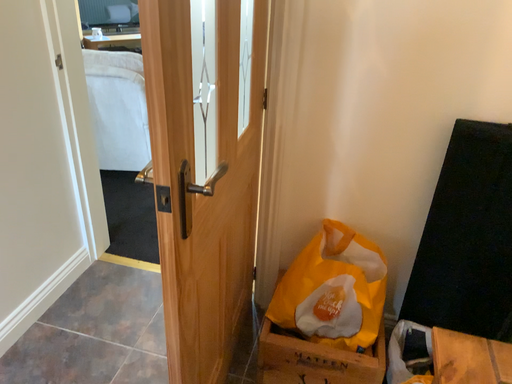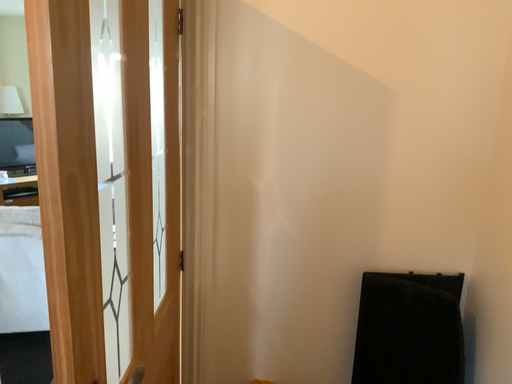
Question: Which way did the camera rotate in the video?

Choices:
 (A) rotated left
 (B) rotated right

Answer: (B)